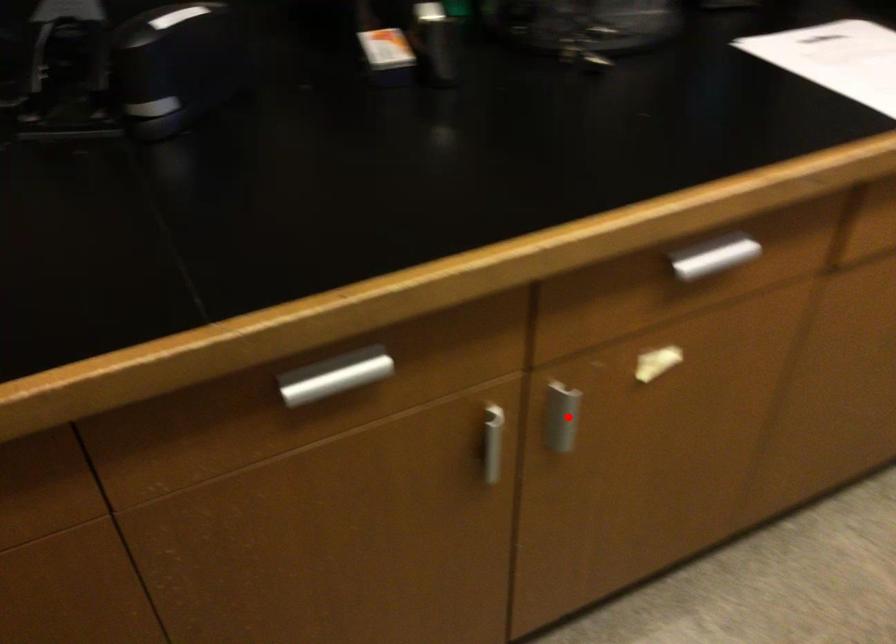
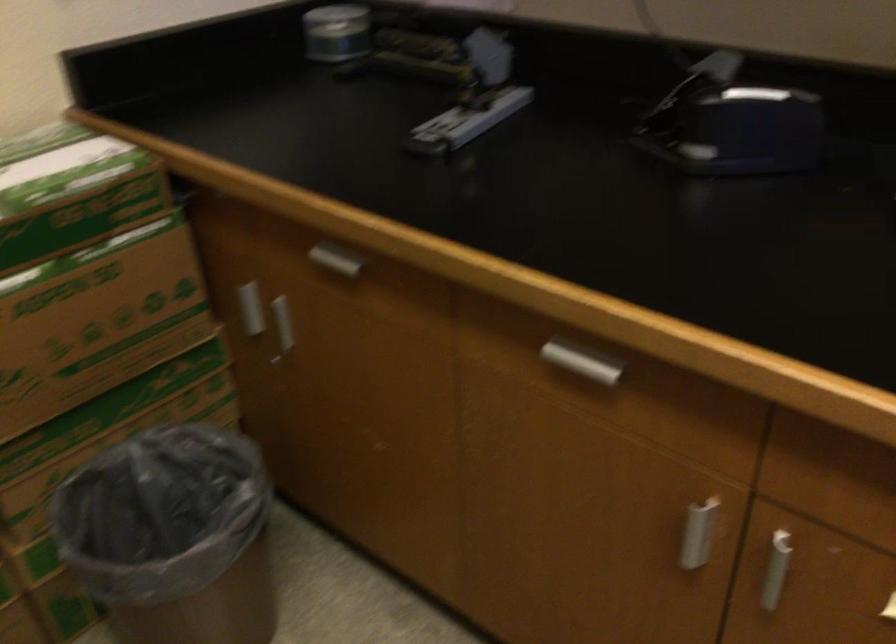
In the second image, find the point that corresponds to the highlighted location in the first image.

(776, 569)